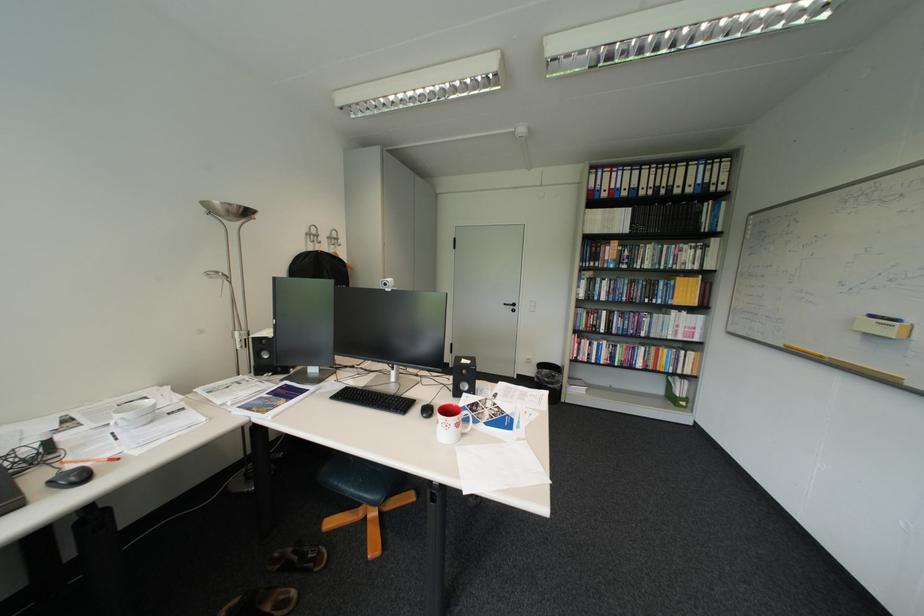
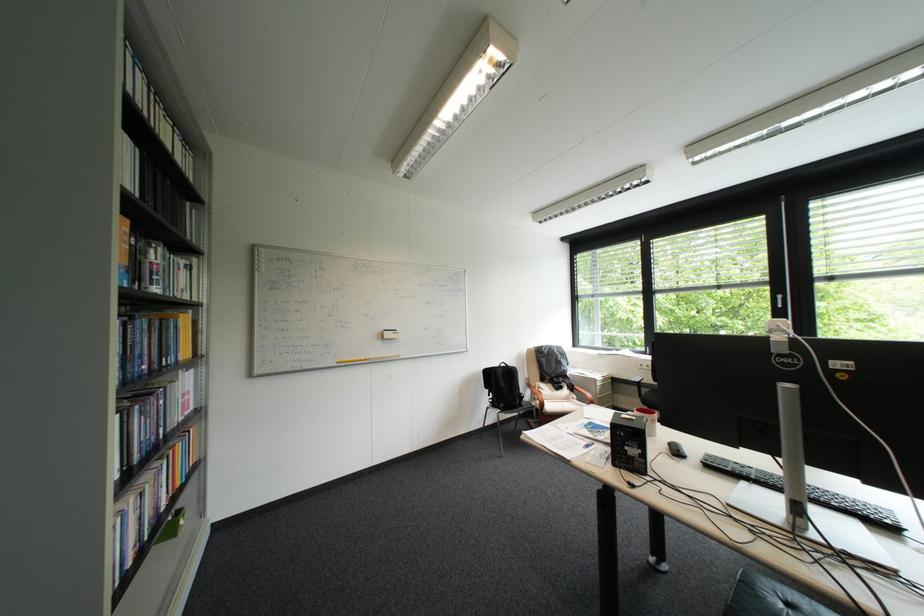
Find the pixel in the second image that matches point 884,315 in the first image.

(397, 331)